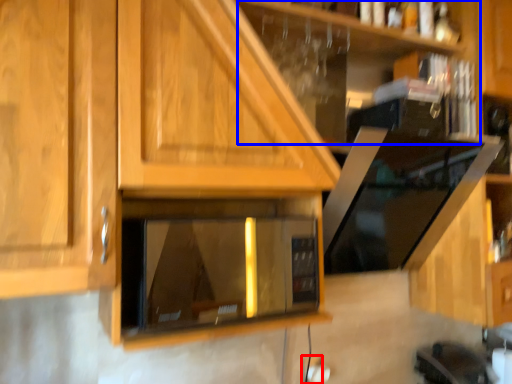
Question: Which point is closer to the camera, electric outlet (highlighted by a red box) or shelf (highlighted by a blue box)?

Choices:
 (A) electric outlet
 (B) shelf

Answer: (B)